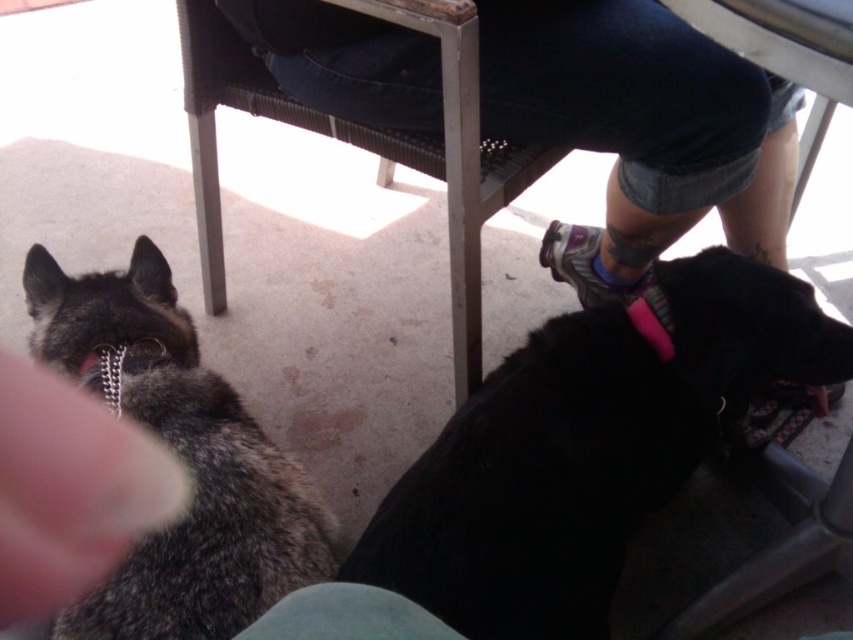
Question: Does black matte dog at lower right have a lesser width compared to metallic frame chair at upper center?

Choices:
 (A) yes
 (B) no

Answer: (A)

Question: Which of the following is the farthest from the observer?

Choices:
 (A) black matte dog at lower right
 (B) fuzzy fur at lower left
 (C) gray fur dog at left
 (D) metallic frame chair at upper center

Answer: (D)

Question: Is black matte dog at lower right thinner than metallic frame chair at upper center?

Choices:
 (A) no
 (B) yes

Answer: (B)

Question: Which of these objects is positioned closest to the fuzzy fur at lower left?

Choices:
 (A) black matte dog at lower right
 (B) gray fur dog at left

Answer: (B)

Question: Which of the following is the closest to the observer?

Choices:
 (A) black matte dog at lower right
 (B) gray fur dog at left
 (C) metallic frame chair at upper center

Answer: (B)

Question: Does jeans at lower right come in front of metallic frame chair at upper center?

Choices:
 (A) yes
 (B) no

Answer: (B)